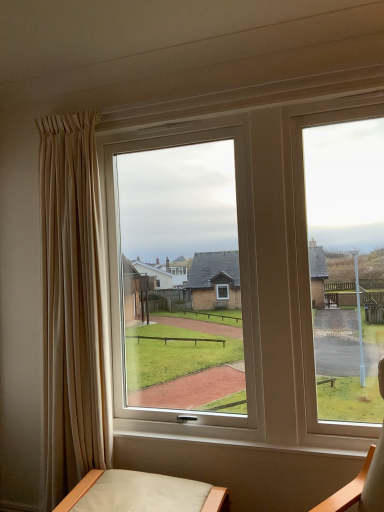
What do you see at coordinates (142, 494) in the screenshot?
I see `leatherette cushioned chair at lower center` at bounding box center [142, 494].

In order to face leatherette cushioned chair at lower center, should I rotate leftwards or rightwards?

It's best to rotate left around 6.945 degrees.

Locate an element on the screen. This screenshot has width=384, height=512. leatherette cushioned chair at lower center is located at coordinates (142, 494).

Locate an element on the screen. This screenshot has width=384, height=512. leatherette cushioned chair at lower center is located at coordinates 142,494.